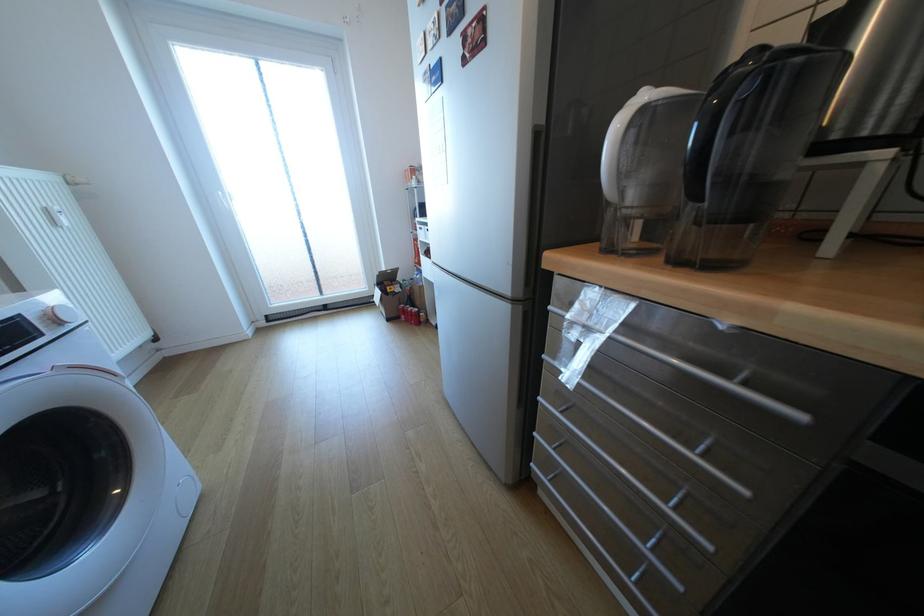
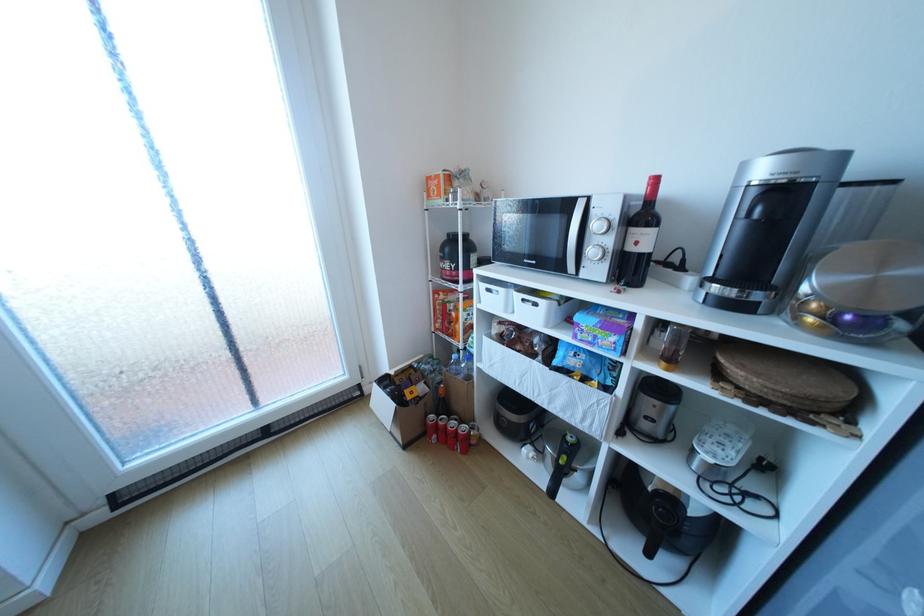
What movement of the cameraman would produce the second image?

The cameraman walked toward left, forward.